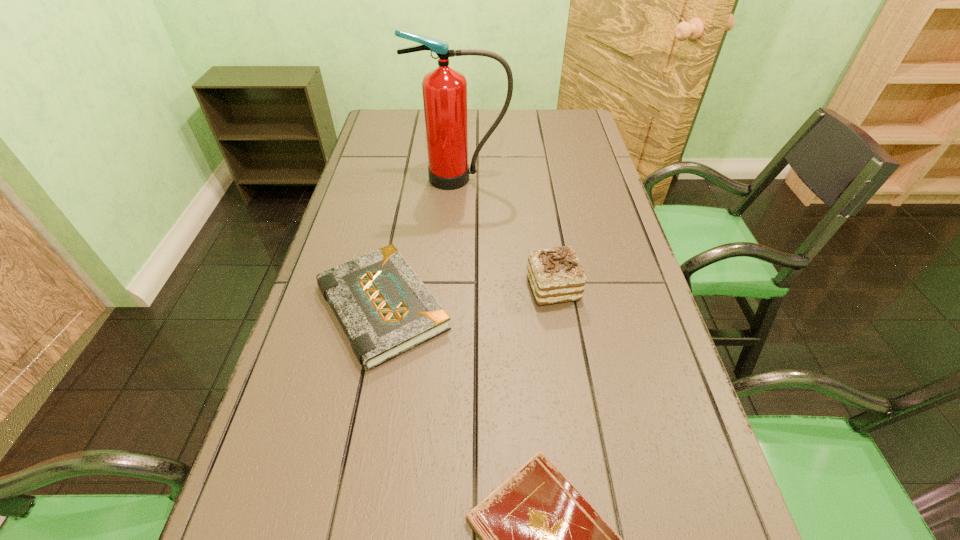
In the image, there is a desktop. In order to click on vacant space at the left edge in this screenshot , I will do [325, 260].

Identify the location of vacant area at the right edge. (555, 152).

This screenshot has width=960, height=540. Identify the location of vacant space at the far right corner of the desktop. (558, 140).

What are the coordinates of `unoccupied position between the left notebook and the third shortest object` in the screenshot? It's located at (468, 298).

Locate an element on the screen. This screenshot has width=960, height=540. free space between the left notebook and the fire extinguisher is located at coordinates (421, 243).

Locate an element on the screen. free space between the left notebook and the chocolate cake is located at coordinates (468, 298).

Locate an element on the screen. empty space that is in between the third shortest object and the tallest object is located at coordinates (507, 233).

The image size is (960, 540). I want to click on object that is the third closest to the chocolate cake, so click(540, 539).

Identify which object is the second closest to the taller notebook. Please provide its 2D coordinates. Your answer should be formatted as a tuple, i.e. [(x, y)], where the tuple contains the x and y coordinates of a point satisfying the conditions above.

[(540, 539)]

Identify the location of vacant space that satisfies the following two spatial constraints: 1. on the back side of the third tallest object; 2. on the left side of the third shortest object. Image resolution: width=960 pixels, height=540 pixels. (386, 288).